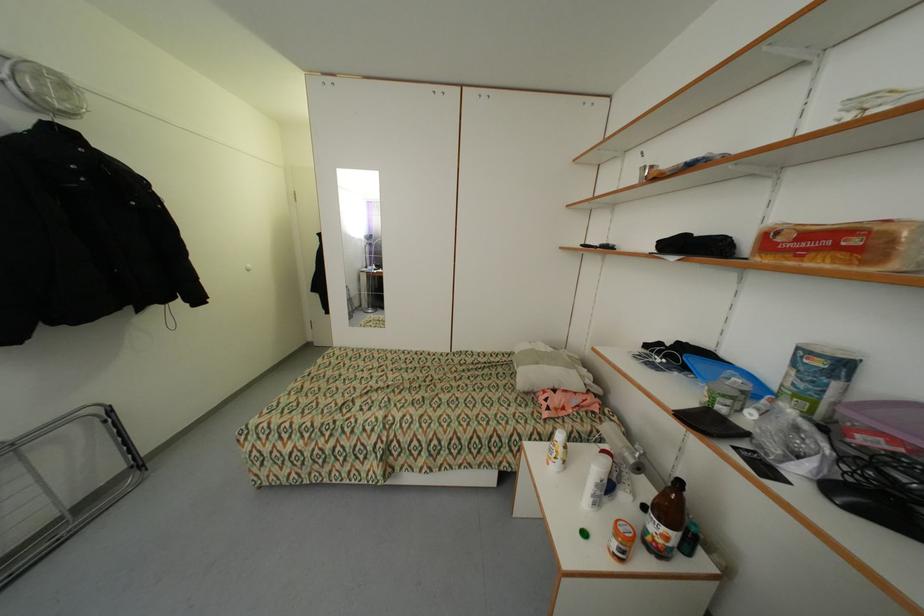
Find the location of a particular element. This screenshot has width=924, height=616. brown glass bottle is located at coordinates (664, 520).